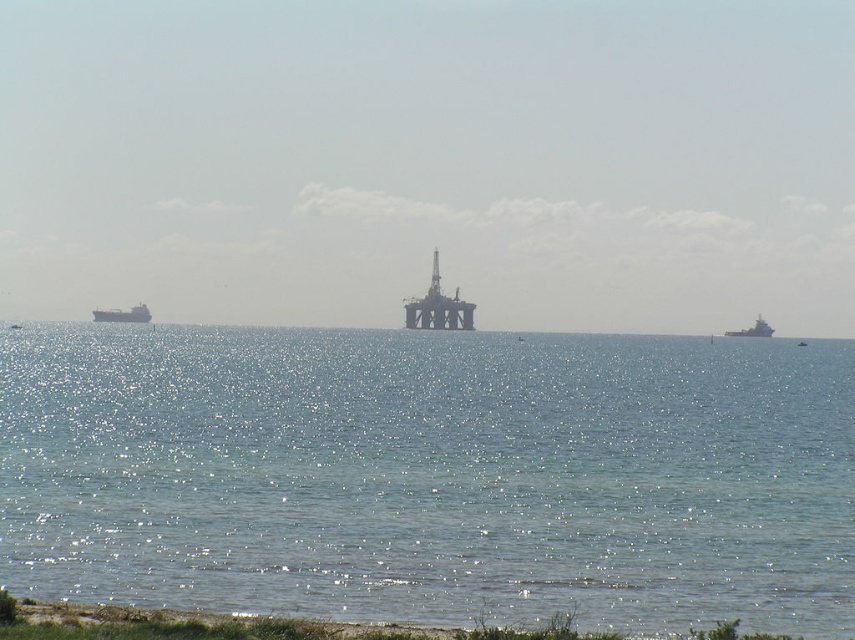
You are a sailor trying to navigate between the clear blue water at center and the matte gray cargo ship at left. Which direction should you steer to move from the ship towards the water?

You should steer to the right to move from the matte gray cargo ship at left towards the clear blue water at center since the clear blue water at center is located to the right of the matte gray cargo ship at left.

You are a drone operator trying to navigate between two points in the seascape. The first point is point (553, 609) and the second point is point (139, 308). Which point is closer to the observer?

Point (553, 609) is in front of point (139, 308), so it is closer to the observer.

You are a drone operator tasked with capturing aerial footage of the point at coordinates (369, 490). The drone has a maximum range of 80 meters. Can the drone reach the point from its current position?

The point at coordinates (369, 490) is 83.41 meters away from the drone, so the drone cannot reach it within its maximum range of 80 meters.